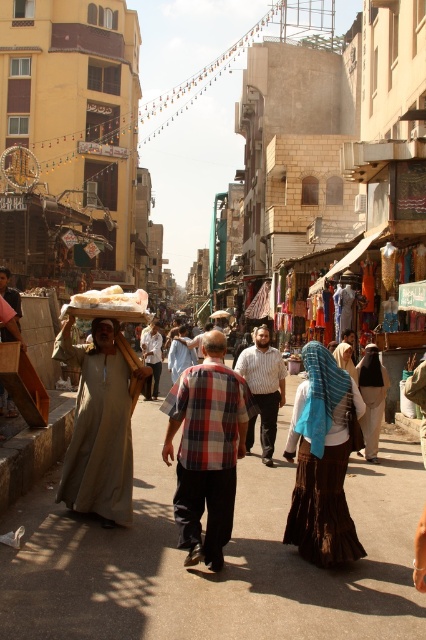
You are standing at the center of the street in the scene. Which direction should you walk to reach the beige cotton robe at left?

Since the beige cotton robe at left is located at point (100,422), you should walk towards the left side of the street to reach it.

You are a photographer standing in the middle of the street. You notice two people wearing a striped cotton shirt at center and a plaid shirt at center. Which shirt is closer to you?

The striped cotton shirt at center is closer to you because it is further to the viewer than the plaid shirt at center.